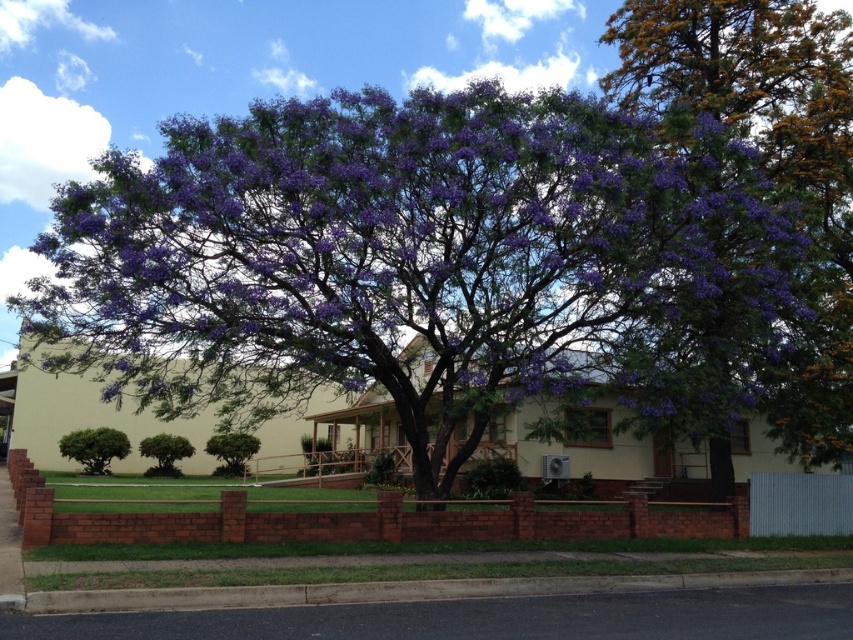
Question: Which point is farther to the camera?

Choices:
 (A) (502, 120)
 (B) (115, 445)
 (C) (230, 435)

Answer: (C)

Question: Is purple leafy tree at upper right smaller than green leafy bush at lower left?

Choices:
 (A) yes
 (B) no

Answer: (B)

Question: Among these points, which one is farthest from the camera?

Choices:
 (A) (70, 444)
 (B) (445, 276)

Answer: (A)

Question: Is purple leafy tree at upper right positioned at the back of green leafy tree at center?

Choices:
 (A) no
 (B) yes

Answer: (A)

Question: Can you confirm if green leafy bush at lower left is wider than green leafy tree at center?

Choices:
 (A) no
 (B) yes

Answer: (B)

Question: Which point is closer to the camera?

Choices:
 (A) green leafy tree at center
 (B) purple matte flowers at center

Answer: (B)